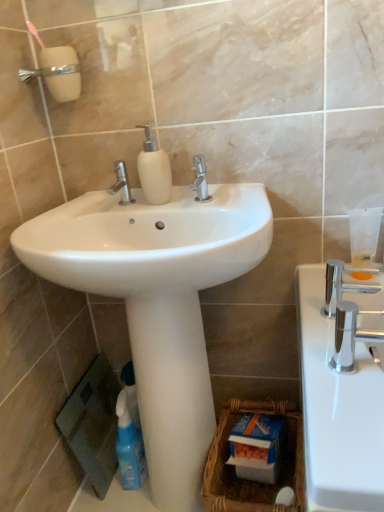
Question: In terms of height, does polished chrome faucet at center, the 2th tap positioned from the right, look taller or shorter compared to polished chrome faucet at right?

Choices:
 (A) short
 (B) tall

Answer: (B)

Question: From the image's perspective, is polished chrome faucet at center, the 2th tap positioned from the right, above or below polished chrome faucet at right?

Choices:
 (A) above
 (B) below

Answer: (A)

Question: Which of these objects is positioned closest to the polished chrome faucet at right?

Choices:
 (A) blue plastic spray bottle at lower left
 (B) polished chrome faucet at right, which is counted as the third tap, starting from the back
 (C) white glossy pedestal at center
 (D) polished chrome faucet at center, arranged as the first tap when viewed from the left
 (E) woven brown basket at lower center

Answer: (B)

Question: Estimate the real-world distances between objects in this image. Which object is closer to the polished chrome faucet at center, arranged as the first tap when viewed from the left?

Choices:
 (A) white matte soap dispenser at center
 (B) polished chrome faucet at center, the 2th tap positioned from the right
 (C) woven brown basket at lower center
 (D) white glossy sink at center
 (E) blue plastic spray bottle at lower left

Answer: (A)